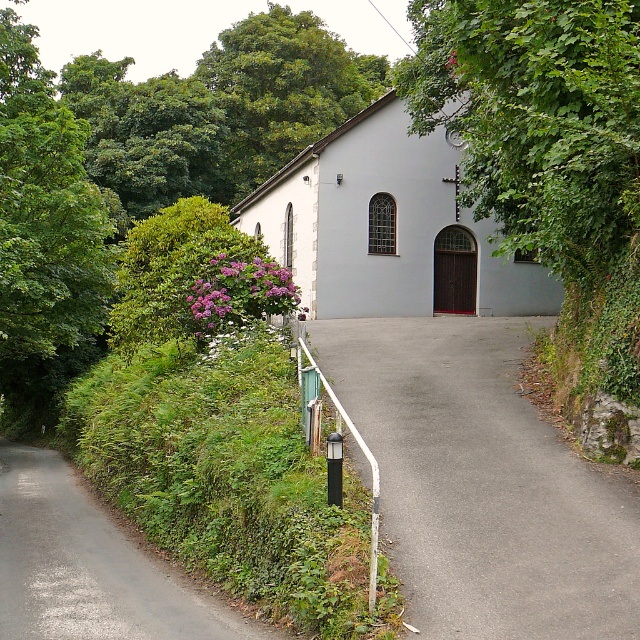
Who is more distant from viewer, (221, 269) or (372, 598)?

The point (221, 269) is behind.

Which is above, purple matte flowers at center-left or white metal rail at lower left?

purple matte flowers at center-left

Where is `purple matte flowers at center-left`? The image size is (640, 640). purple matte flowers at center-left is located at coordinates (240, 291).

This screenshot has height=640, width=640. I want to click on purple matte flowers at center-left, so click(240, 291).

Who is more forward, (86, 492) or (268, 314)?

Point (268, 314) is more forward.

Is green grassy driveway at lower left above purple matte flowers at center-left?

No.

I want to click on green grassy driveway at lower left, so click(x=90, y=564).

Locate an element on the screen. The height and width of the screenshot is (640, 640). green grassy driveway at lower left is located at coordinates (90, 564).

Is the position of gray asphalt driveway at center less distant than that of white smooth church at center?

Yes, gray asphalt driveway at center is closer to the viewer.

Between point (488, 515) and point (387, 113), which one is positioned behind?

The point (387, 113) is behind.

The height and width of the screenshot is (640, 640). What are the coordinates of `gray asphalt driveway at center` in the screenshot? It's located at (483, 483).